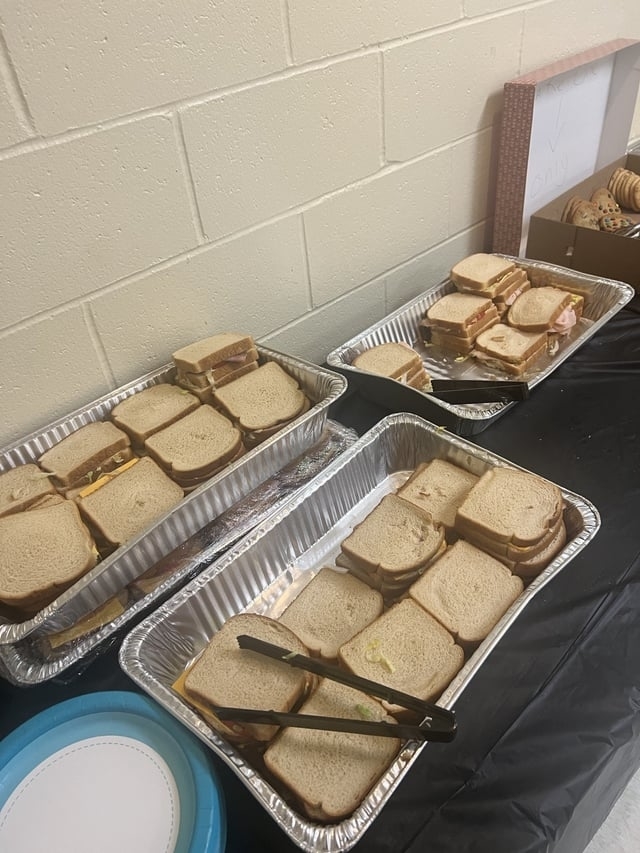
What are the coordinates of `box` in the screenshot? It's located at (596, 247).